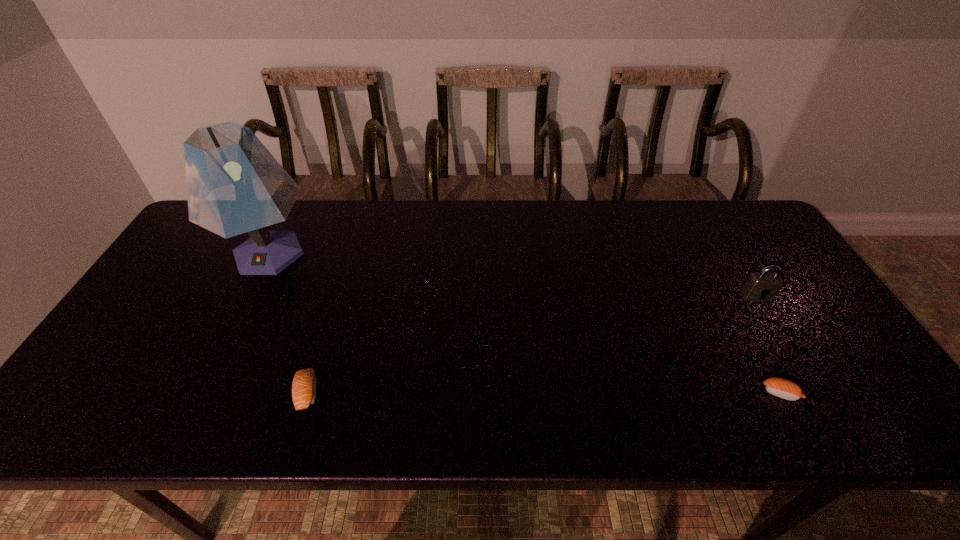
In order to click on vacant point that satisfies the following two spatial constraints: 1. on the base of the right sushi; 2. on the right side of the lampshade in this screenshot , I will do `click(199, 393)`.

The width and height of the screenshot is (960, 540). In order to click on free space in the image that satisfies the following two spatial constraints: 1. on the front side of the second object from left to right; 2. on the left side of the right sushi in this screenshot , I will do `click(307, 393)`.

Find the location of `vacant region that satisfies the following two spatial constraints: 1. on the base of the second object from left to right; 2. on the right side of the tallest object`. vacant region that satisfies the following two spatial constraints: 1. on the base of the second object from left to right; 2. on the right side of the tallest object is located at coordinates (200, 393).